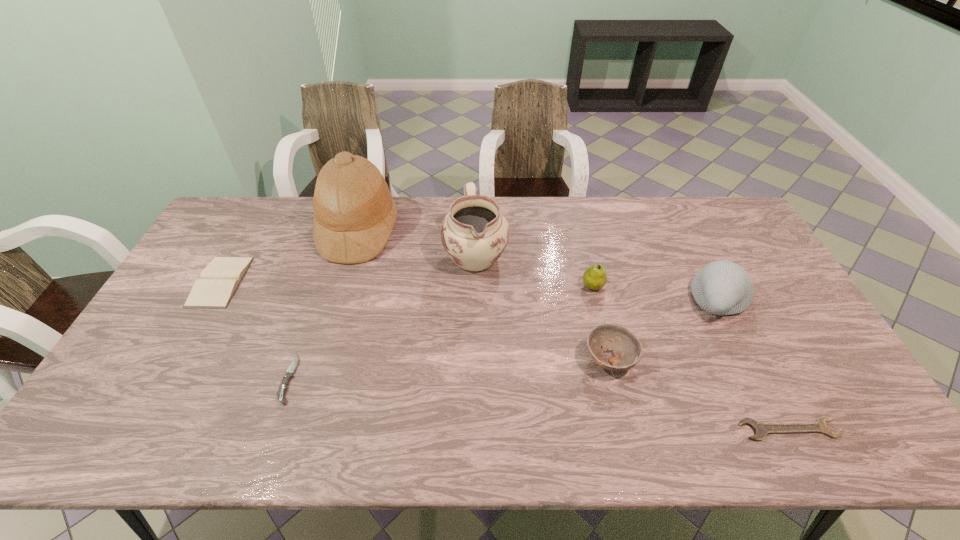
This screenshot has width=960, height=540. Find the location of `free region at the far left corner`. free region at the far left corner is located at coordinates (228, 213).

The height and width of the screenshot is (540, 960). I want to click on vacant space at the far right corner of the desktop, so click(x=706, y=200).

The width and height of the screenshot is (960, 540). Find the location of `free spot between the pocketknife and the fifth shortest object`. free spot between the pocketknife and the fifth shortest object is located at coordinates (442, 333).

This screenshot has height=540, width=960. What are the coordinates of `vacant point located between the bowl and the beanie` in the screenshot? It's located at (664, 329).

Find the location of a particular element. This screenshot has width=960, height=540. free space between the leftmost object and the pear is located at coordinates (407, 284).

You are a GUI agent. You are given a task and a screenshot of the screen. Output one action in this format:
    pyautogui.click(x=<x>, y=<y>)
    Task: Click on the vacant point located between the pocketknife and the fourth shortest object
    The width and height of the screenshot is (960, 540).
    Given the screenshot: What is the action you would take?
    pyautogui.click(x=449, y=369)

I want to click on free space between the leftmost object and the tallest object, so click(290, 256).

Identify the location of vacant space in between the pocketknife and the fifth tallest object. The height and width of the screenshot is (540, 960). tap(449, 369).

This screenshot has height=540, width=960. I want to click on free space that is in between the fifth tallest object and the pocketknife, so click(449, 369).

Where is `empty space between the nearest object and the bowl`? empty space between the nearest object and the bowl is located at coordinates (x=699, y=395).